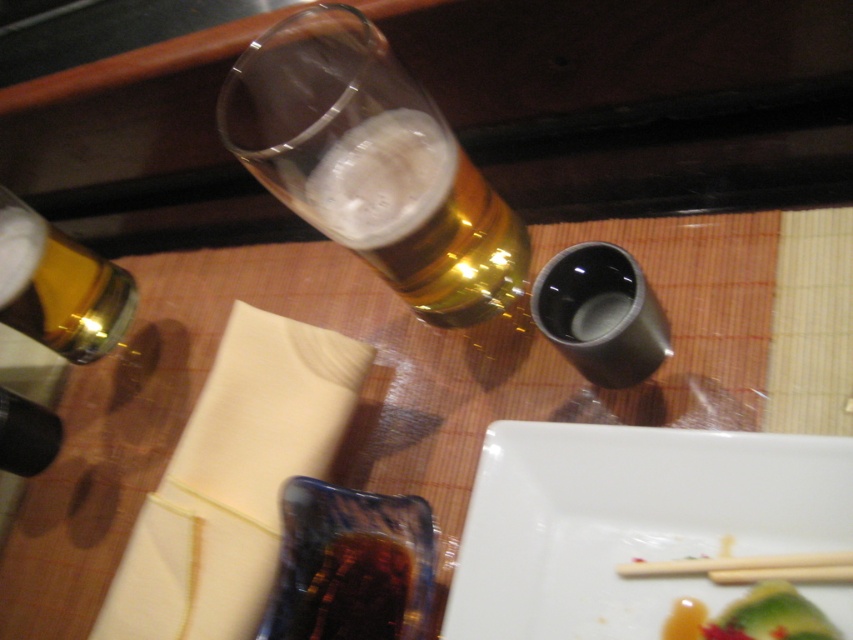
You are a server at a restaurant and need to place a new drink order on the table. The customer has requested a drink that requires more space due to its size. Looking at the golden glass beer at upper center and the gold metallic bottle at upper left, which one should you choose to place first to ensure there is enough space for both?

The golden glass beer at upper center is larger in size than the gold metallic bottle at upper left, so you should place the golden glass beer at upper center first to ensure there is enough space for both.

You are a waiter at a restaurant and need to place a new order of a small dessert plate on the table. The dessert plate must be placed exactly at the point with coordinates point (372, 164). However, there is already a golden glass beer at upper center. Is there enough space to place the dessert plate at that point without overlapping the golden glass beer?

The point (372, 164) is on golden glass beer at upper center, so placing the dessert plate there would overlap with the golden glass beer, making it impossible to place the dessert plate without overlapping.